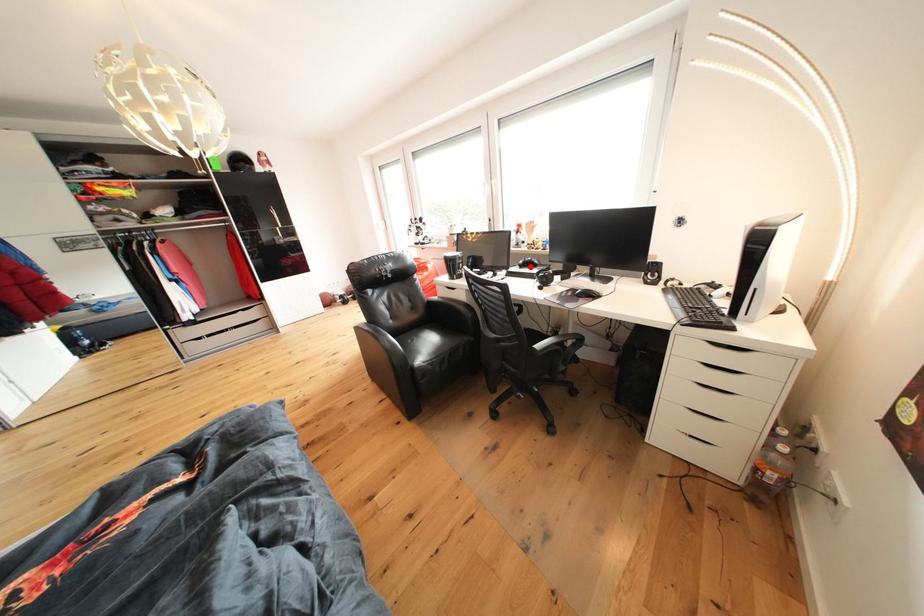
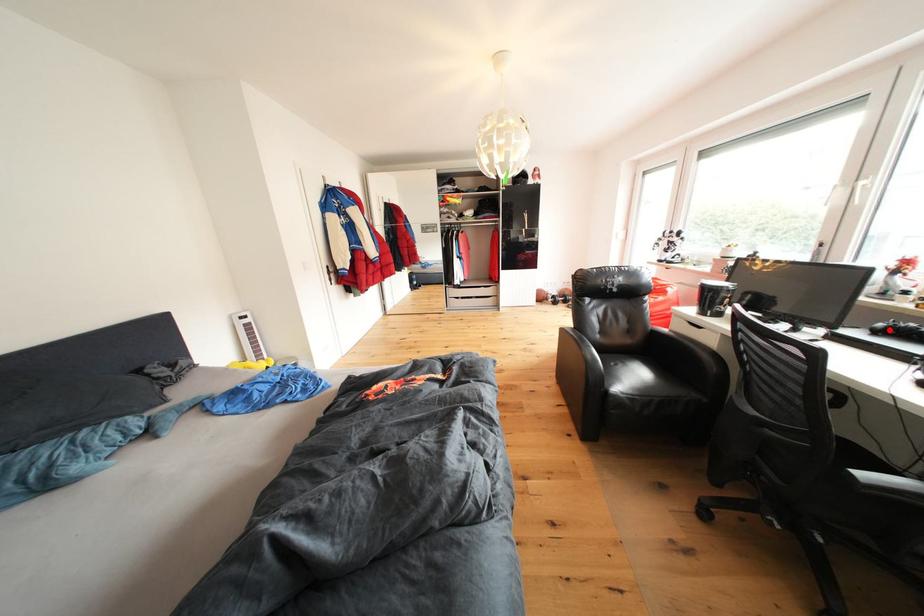
I am providing you with two images of the same scene from different viewpoints. A red point is marked on the first image and another point is marked on the second image. Are the points marked in image1 and image2 representing the same 3D position?

Yes